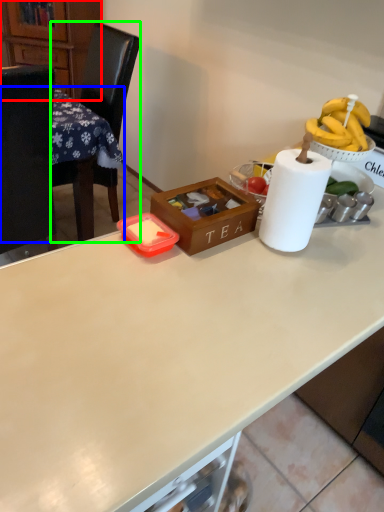
Question: Which object is positioned closest to cabinetry (highlighted by a red box)? Select from table (highlighted by a blue box) and chair (highlighted by a green box).

Choices:
 (A) table
 (B) chair

Answer: (B)